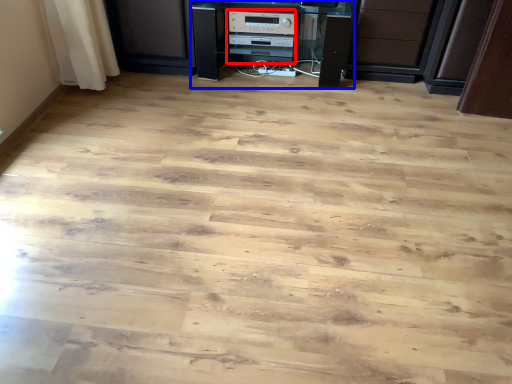
Question: Among these objects, which one is nearest to the camera, appliance (highlighted by a red box) or furniture (highlighted by a blue box)?

Choices:
 (A) appliance
 (B) furniture

Answer: (B)